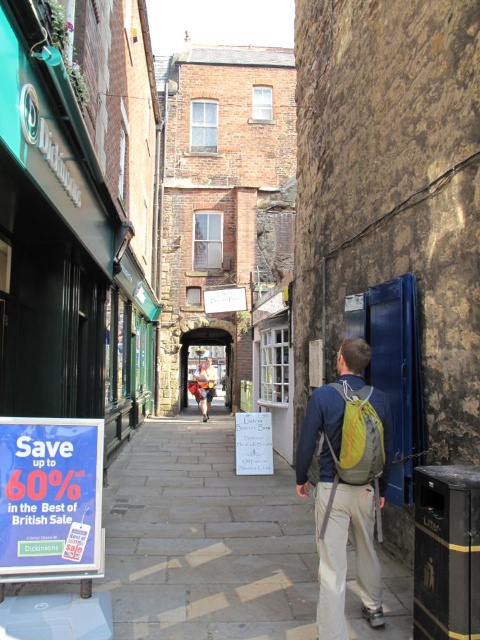
Question: Which point appears farthest from the camera in this image?

Choices:
 (A) (316, 616)
 (B) (93, 572)
 (C) (200, 371)

Answer: (C)

Question: In this image, where is white wooden sign at center located relative to camouflage shorts at center?

Choices:
 (A) right
 (B) left

Answer: (A)

Question: Observing the image, what is the correct spatial positioning of green fabric backpack at center in reference to white wooden sign at center?

Choices:
 (A) above
 (B) below

Answer: (A)

Question: Among these points, which one is nearest to the camera?

Choices:
 (A) (248, 465)
 (B) (196, 380)

Answer: (A)

Question: Is paved stone pavement at lower center behind white wooden sign at center?

Choices:
 (A) yes
 (B) no

Answer: (B)

Question: Which object is farther from the camera taking this photo?

Choices:
 (A) green fabric backpack at center
 (B) camouflage shorts at center

Answer: (B)